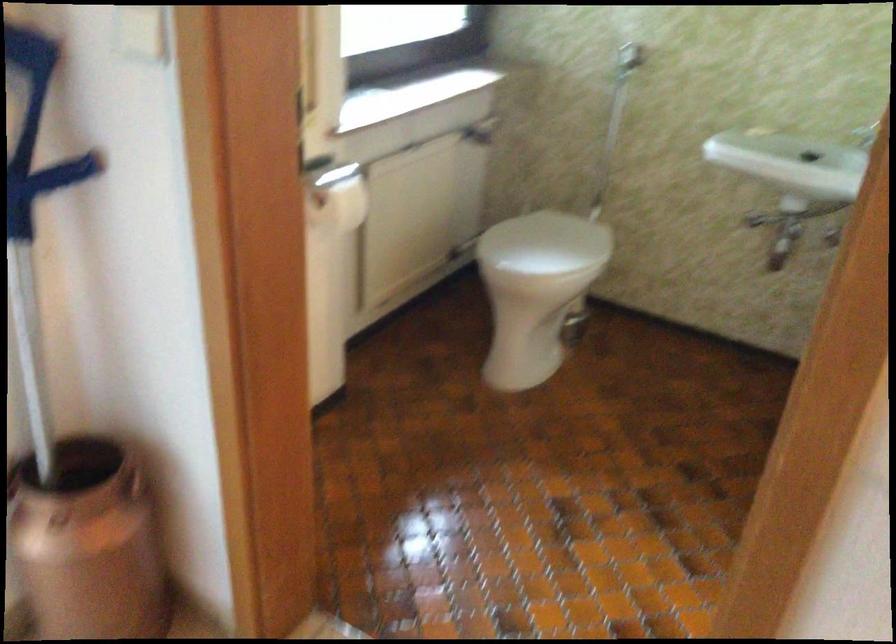
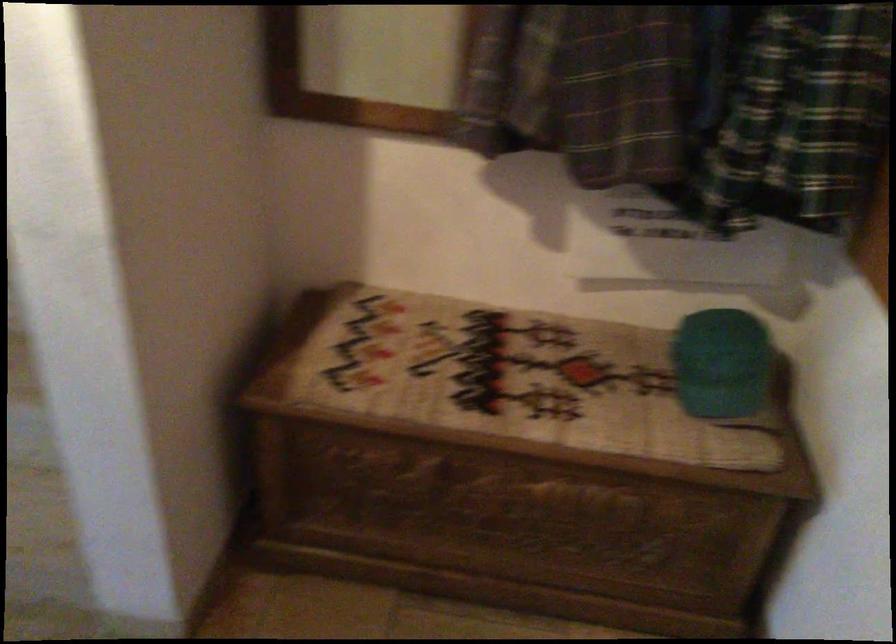
Which direction would the cameraman need to move to produce the second image?

The cameraman moved toward right, backward.